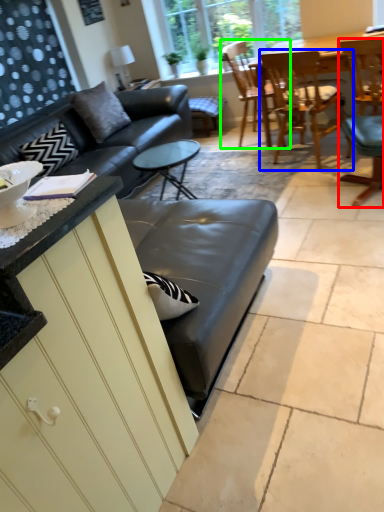
Question: Considering the real-world distances, which object is farthest from chair (highlighted by a red box)? chair (highlighted by a blue box) or chair (highlighted by a green box)?

Choices:
 (A) chair
 (B) chair

Answer: (B)